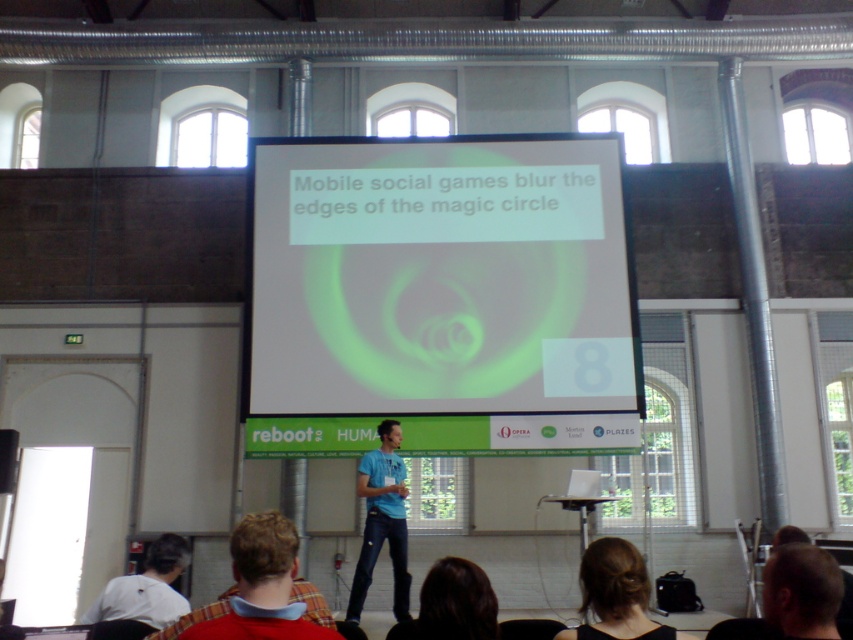
You are an attendee at the presentation and want to know who is taller between the two people on stage. The people you can see are the blonde hair at lower right and the dark brown hair at lower center. According to the image, which one is taller?

The blonde hair at lower right is taller than the dark brown hair at lower center based on the image description.

Based on the photo, you are sitting in the audience and looking at the stage. There are two points marked on the stage floor. The first point is at coordinates point (509, 337) and the second is at point (828, 580). If you were to walk from the first point to the second, would you be moving towards the presenter or away from him?

The point (509, 337) is further to the camera than point (828, 580). Since the presenter is on the stage to the left of the screen, moving from the first point to the second would take you away from the presenter towards the back of the stage.